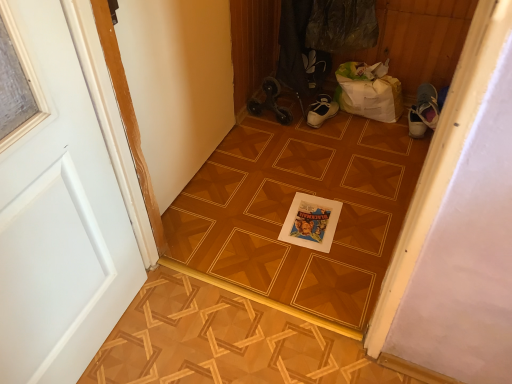
Question: Is wooden parquet floor at center to the left of white painted wood door at left from the viewer's perspective?

Choices:
 (A) yes
 (B) no

Answer: (B)

Question: Can you confirm if wooden parquet floor at center is shorter than white painted wood door at left?

Choices:
 (A) no
 (B) yes

Answer: (B)

Question: Is wooden parquet floor at center further to the viewer compared to white painted wood door at left?

Choices:
 (A) yes
 (B) no

Answer: (A)

Question: Is wooden parquet floor at center completely or partially outside of white painted wood door at left?

Choices:
 (A) yes
 (B) no

Answer: (A)

Question: Is wooden parquet floor at center aimed at white painted wood door at left?

Choices:
 (A) yes
 (B) no

Answer: (B)

Question: Is wooden parquet floor at center positioned with its back to white painted wood door at left?

Choices:
 (A) no
 (B) yes

Answer: (A)

Question: From a real-world perspective, does wooden parquet floor at center sit lower than wooden parquet floor at center?

Choices:
 (A) yes
 (B) no

Answer: (B)

Question: Would you consider wooden parquet floor at center to be distant from wooden parquet floor at center?

Choices:
 (A) yes
 (B) no

Answer: (B)

Question: Is the depth of wooden parquet floor at center greater than that of wooden parquet floor at center?

Choices:
 (A) no
 (B) yes

Answer: (B)

Question: Does wooden parquet floor at center have a greater width compared to wooden parquet floor at center?

Choices:
 (A) yes
 (B) no

Answer: (A)

Question: Is wooden parquet floor at center bigger than wooden parquet floor at center?

Choices:
 (A) no
 (B) yes

Answer: (B)

Question: From a real-world perspective, is wooden parquet floor at center located higher than wooden parquet floor at center?

Choices:
 (A) no
 (B) yes

Answer: (B)

Question: Is wooden parquet floor at center facing towards white painted wood door at left?

Choices:
 (A) yes
 (B) no

Answer: (B)